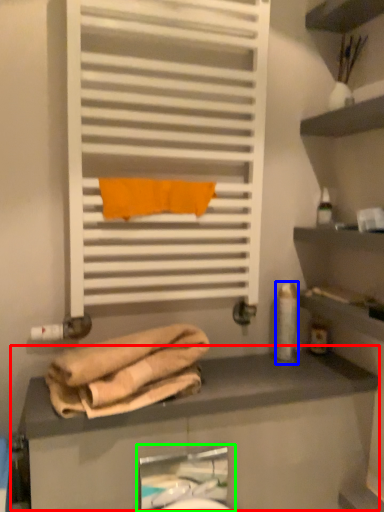
Question: Which object is positioned farthest from counter (highlighted by a red box)? Select from toiletry (highlighted by a blue box) and sink (highlighted by a green box).

Choices:
 (A) toiletry
 (B) sink

Answer: (B)